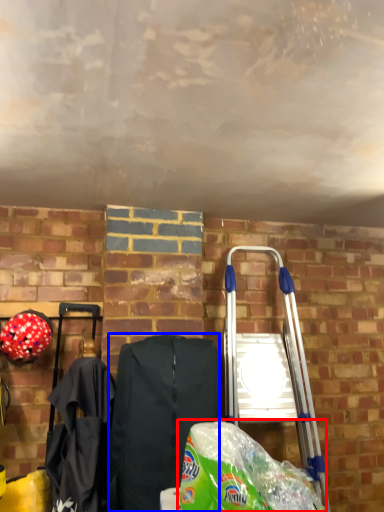
Question: Which object appears closest to the camera in this image, grocery bag (highlighted by a red box) or folding chair (highlighted by a blue box)?

Choices:
 (A) grocery bag
 (B) folding chair

Answer: (A)